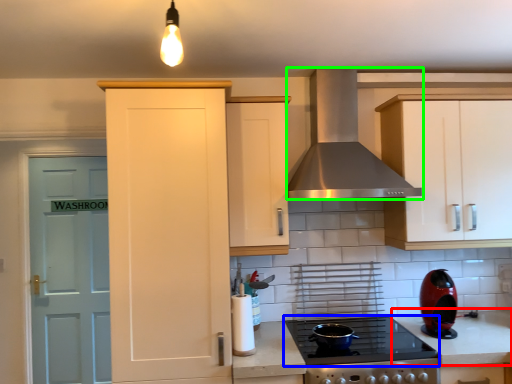
Question: Considering the real-world distances, which object is closest to counter top (highlighted by a red box)? gas stove (highlighted by a blue box) or home appliance (highlighted by a green box).

Choices:
 (A) gas stove
 (B) home appliance

Answer: (A)